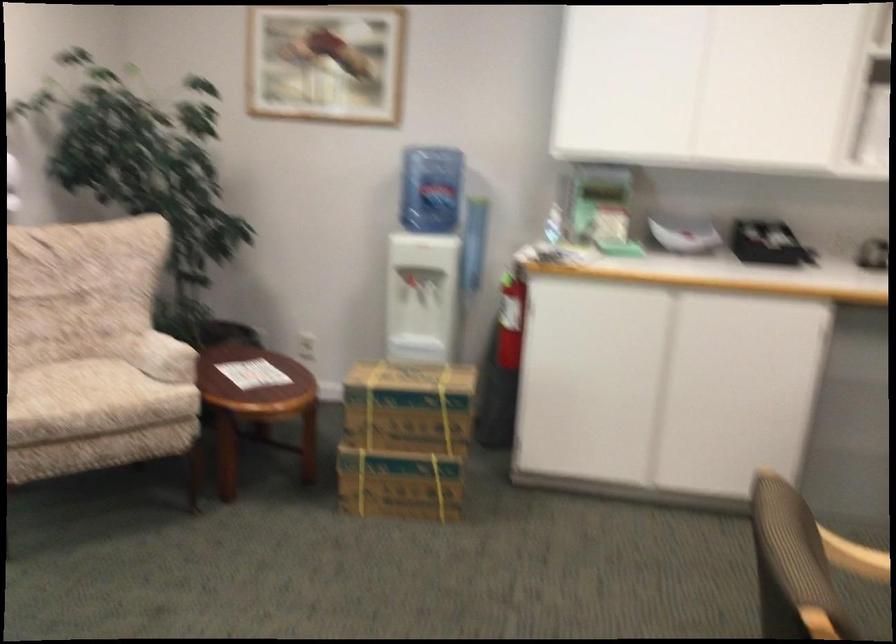
The width and height of the screenshot is (896, 644). Describe the element at coordinates (866, 607) in the screenshot. I see `the chair sitting surface` at that location.